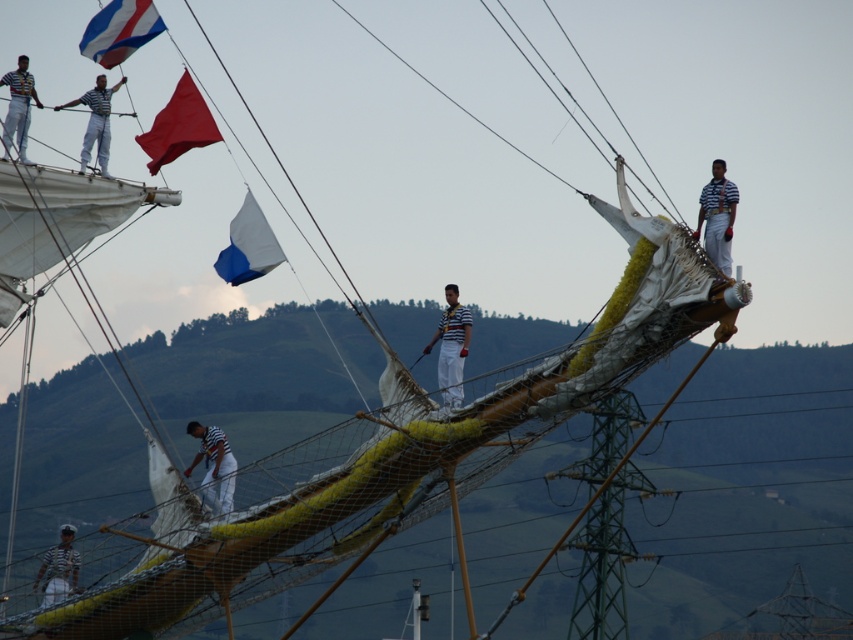
Is red fabric flag at upper center positioned before white striped shirt at upper right?

No, it is not.

Who is more distant from viewer, (160, 141) or (711, 240)?

Positioned behind is point (160, 141).

The image size is (853, 640). Find the location of `red fabric flag at upper center`. red fabric flag at upper center is located at coordinates (178, 125).

Does blue and white striped fabric at upper left appear on the right side of striped fabric sailor at center?

Incorrect, blue and white striped fabric at upper left is not on the right side of striped fabric sailor at center.

Consider the image. Between blue and white striped fabric at upper left and striped fabric sailor at center, which one appears on the left side from the viewer's perspective?

blue and white striped fabric at upper left

Between point (115, 10) and point (209, 456), which one is positioned behind?

Positioned behind is point (115, 10).

At what (x,y) coordinates should I click in order to perform the action: click on blue and white striped fabric at upper left. Please return your answer as a coordinate pair (x, y). The image size is (853, 640). Looking at the image, I should click on click(119, 29).

Is point (224, 257) positioned behind point (460, 314)?

Yes, it is.

At what (x,y) coordinates should I click in order to perform the action: click on blue matte flag at center. Please return your answer as a coordinate pair (x, y). This screenshot has height=640, width=853. Looking at the image, I should click on (248, 244).